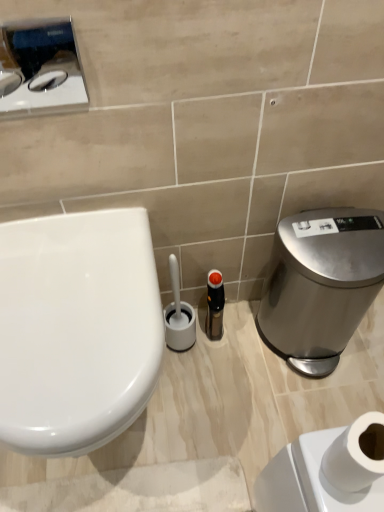
At what (x,y) coordinates should I click in order to perform the action: click on empty space that is ontop of white glossy toilet at left (from a real-world perspective). Please return your answer as a coordinate pair (x, y). This screenshot has height=512, width=384. Looking at the image, I should click on (59, 292).